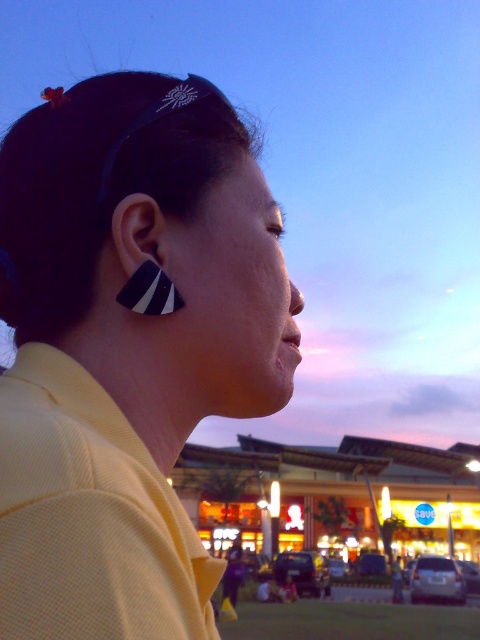
Question: Is matte yellow shirt at center wider than black matte/striped earring at left?

Choices:
 (A) yes
 (B) no

Answer: (A)

Question: Is matte yellow shirt at center positioned at the back of black matte/striped earring at left?

Choices:
 (A) yes
 (B) no

Answer: (B)

Question: Does matte yellow shirt at center come behind black matte/striped earring at left?

Choices:
 (A) yes
 (B) no

Answer: (B)

Question: Which point is farther from the camera taking this photo?

Choices:
 (A) (193, 152)
 (B) (129, 216)

Answer: (A)

Question: Which object is farther from the camera taking this photo?

Choices:
 (A) matte yellow shirt at center
 (B) black matte/striped earring at left

Answer: (B)